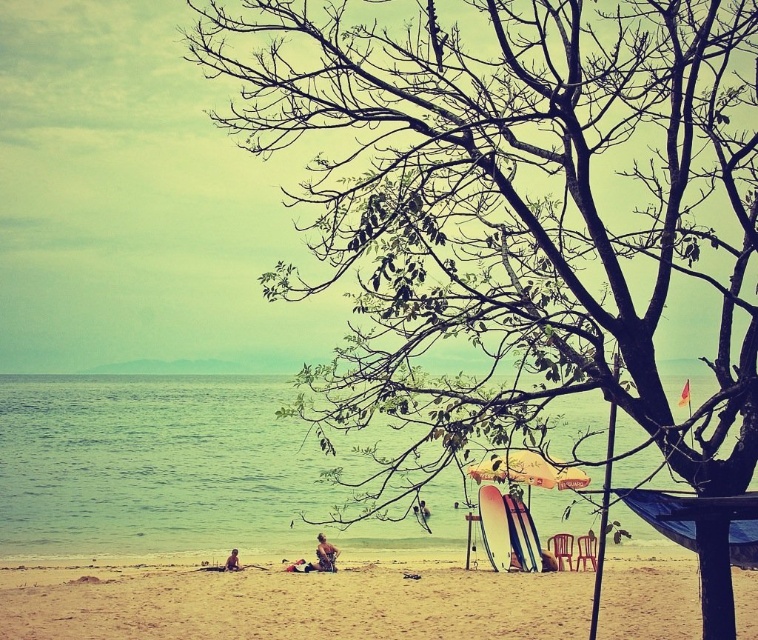
Question: Which point appears farthest from the camera in this image?

Choices:
 (A) (421, 522)
 (B) (243, 378)
 (C) (208, 572)
 (D) (561, 540)

Answer: (B)

Question: Is beige sand at lower center above brown leather bag at lower center?

Choices:
 (A) yes
 (B) no

Answer: (B)

Question: Considering the relative positions of tan skin person at lower left and smooth skin person at lower center in the image provided, where is tan skin person at lower left located with respect to smooth skin person at lower center?

Choices:
 (A) below
 (B) above

Answer: (A)

Question: Does wooden beach chair at lower right appear over brown leather bag at lower center?

Choices:
 (A) no
 (B) yes

Answer: (B)

Question: Which object appears closest to the camera in this image?

Choices:
 (A) green water at lower left
 (B) wooden beach chair at lower right
 (C) beige sand at lower center

Answer: (C)

Question: Which is farther from the wooden surfboard at lower center?

Choices:
 (A) smooth skin person at lower center
 (B) metallic silver beach chair at lower right
 (C) beige sand at lower center
 (D) tan skin person at lower left

Answer: (D)